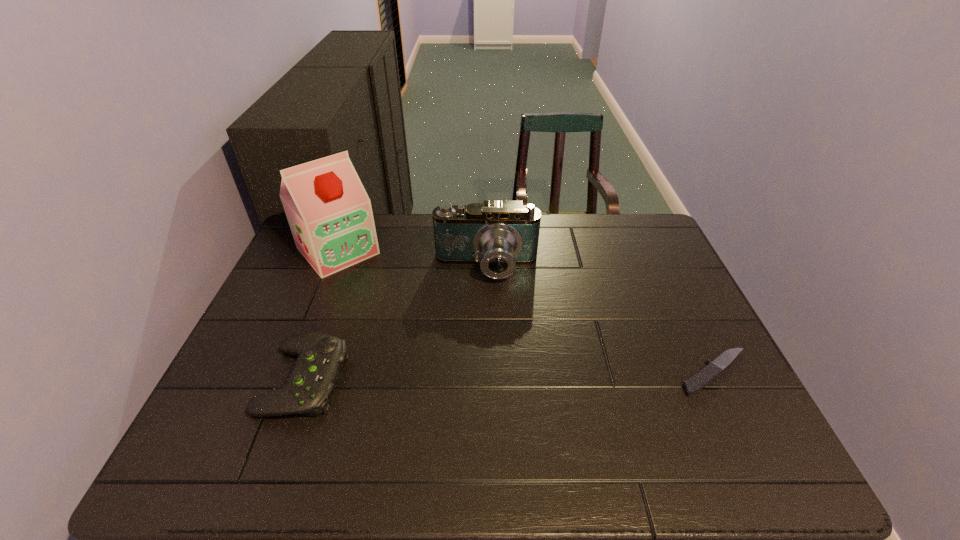
Image resolution: width=960 pixels, height=540 pixels. What are the coordinates of `vacant area that satisfies the following two spatial constraints: 1. on the front side of the camcorder; 2. on the left side of the shortest object` in the screenshot? It's located at (488, 373).

You are a GUI agent. You are given a task and a screenshot of the screen. Output one action in this format:
    pyautogui.click(x=<x>, y=<y>)
    Task: Click on the vacant space that satisfies the following two spatial constraints: 1. on the front side of the rightmost object; 2. on the right side of the second tallest object
    
    Given the screenshot: What is the action you would take?
    pyautogui.click(x=488, y=373)